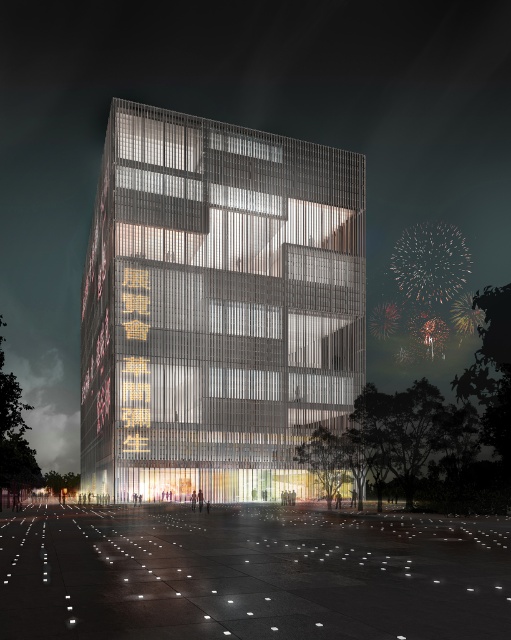
Can you confirm if metallic glass tower at center is bigger than white concrete plaza at lower center?

Yes, metallic glass tower at center is bigger than white concrete plaza at lower center.

The image size is (511, 640). What do you see at coordinates (217, 307) in the screenshot?
I see `metallic glass tower at center` at bounding box center [217, 307].

Which is in front, point (129, 104) or point (143, 586)?

Positioned in front is point (143, 586).

This screenshot has width=511, height=640. What are the coordinates of `metallic glass tower at center` in the screenshot? It's located at (217, 307).